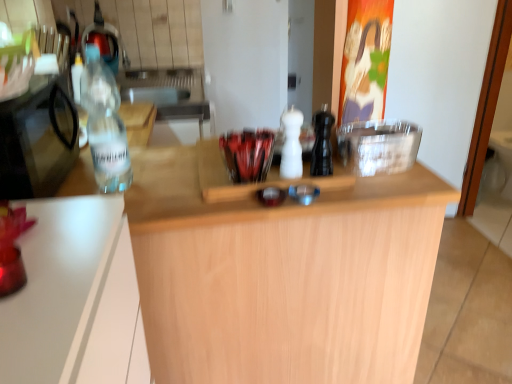
This screenshot has width=512, height=384. I want to click on clear glass bottle at left, the 3th bottle positioned from the right, so click(x=105, y=126).

The height and width of the screenshot is (384, 512). Describe the element at coordinates (105, 126) in the screenshot. I see `clear glass bottle at left, the first bottle in the left-to-right sequence` at that location.

Locate an element on the screen. The image size is (512, 384). black matte pepper grinder at center, arranged as the first bottle when viewed from the right is located at coordinates (322, 143).

Where is `white matte salt shaker at center, placed as the second bottle when sorted from right to left`? white matte salt shaker at center, placed as the second bottle when sorted from right to left is located at coordinates (291, 145).

What do you see at coordinates (37, 141) in the screenshot? I see `transparent plastic bottle at left, the second appliance viewed from the right` at bounding box center [37, 141].

Where is `clear glass bottle at left, the 3th bottle positioned from the right`? clear glass bottle at left, the 3th bottle positioned from the right is located at coordinates (105, 126).

Is white matte salt shaker at center, placed as the second bottle when sorted from right to left, positioned with its back to light wood countertop at center?

No, light wood countertop at center is not at the back of white matte salt shaker at center, placed as the second bottle when sorted from right to left.

How distant is white matte salt shaker at center, placed as the second bottle when sorted from right to left, from light wood countertop at center?

The distance of white matte salt shaker at center, placed as the second bottle when sorted from right to left, from light wood countertop at center is 15.11 inches.

Visually, is white matte salt shaker at center, placed as the second bottle when sorted from right to left, positioned to the left or to the right of light wood countertop at center?

white matte salt shaker at center, placed as the second bottle when sorted from right to left, is positioned on light wood countertop at center's right side.

Between white matte salt shaker at center, which is the 2th bottle in left-to-right order, and light wood countertop at center, which one is positioned in front?

Positioned in front is light wood countertop at center.

Is black matte pepper grinder at center, arranged as the first bottle when viewed from the right, located outside clear glass bottle at left, the 3th bottle positioned from the right?

That's correct, black matte pepper grinder at center, arranged as the first bottle when viewed from the right, is outside of clear glass bottle at left, the 3th bottle positioned from the right.

Is black matte pepper grinder at center, arranged as the first bottle when viewed from the right, beside clear glass bottle at left, the 3th bottle positioned from the right?

black matte pepper grinder at center, arranged as the first bottle when viewed from the right, and clear glass bottle at left, the 3th bottle positioned from the right, are clearly separated.

Which of these two, black matte pepper grinder at center, arranged as the first bottle when viewed from the right, or clear glass bottle at left, the 3th bottle positioned from the right, is wider?

With larger width is clear glass bottle at left, the 3th bottle positioned from the right.

Which is in front, point (321, 120) or point (109, 123)?

The point (109, 123) is in front.

Is clear glass bottle at left, the 3th bottle positioned from the right, inside or outside of transparent plastic bottle at left, the first appliance from the left?

The correct answer is: outside.

Does clear glass bottle at left, the 3th bottle positioned from the right, have a larger size compared to transparent plastic bottle at left, the second appliance viewed from the right?

No, clear glass bottle at left, the 3th bottle positioned from the right, is not bigger than transparent plastic bottle at left, the second appliance viewed from the right.

What's the angular difference between clear glass bottle at left, the 3th bottle positioned from the right, and transparent plastic bottle at left, the first appliance from the left,'s facing directions?

90 degrees.

Looking at this image, is clear glass bottle at left, the 3th bottle positioned from the right, to the left of transparent plastic bottle at left, the first appliance from the left, from the viewer's perspective?

No.

Which of these two, transparent plastic bottle at left, the second appliance viewed from the right, or white matte salt shaker at center, placed as the second bottle when sorted from right to left, is wider?

With larger width is transparent plastic bottle at left, the second appliance viewed from the right.

Identify the location of the 1st appliance below the white matte salt shaker at center, placed as the second bottle when sorted from right to left (from the image's perspective). The image size is (512, 384). (37, 141).

Is transparent plastic bottle at left, the first appliance from the left, next to white matte salt shaker at center, which is the 2th bottle in left-to-right order?

No, transparent plastic bottle at left, the first appliance from the left, is not with white matte salt shaker at center, which is the 2th bottle in left-to-right order.

From the image's perspective, is transparent plastic bottle at left, the second appliance viewed from the right, under white matte salt shaker at center, which is the 2th bottle in left-to-right order?

Correct, transparent plastic bottle at left, the second appliance viewed from the right, appears lower than white matte salt shaker at center, which is the 2th bottle in left-to-right order, in the image.

Consider the image. From the image's perspective, is white matte salt shaker at center, placed as the second bottle when sorted from right to left, located above black matte pepper grinder at center, arranged as the first bottle when viewed from the right?

Indeed, from the image's perspective, white matte salt shaker at center, placed as the second bottle when sorted from right to left, is shown above black matte pepper grinder at center, arranged as the first bottle when viewed from the right.

Where is `the 1st bottle in front of the white matte salt shaker at center, placed as the second bottle when sorted from right to left`? This screenshot has width=512, height=384. the 1st bottle in front of the white matte salt shaker at center, placed as the second bottle when sorted from right to left is located at coordinates (322, 143).

Is point (289, 171) closer to camera compared to point (322, 156)?

Yes, it is in front of point (322, 156).

How different are the orientations of white matte salt shaker at center, placed as the second bottle when sorted from right to left, and black matte pepper grinder at center, marked as the third bottle in a left-to-right arrangement, in degrees?

They differ by 4.97 degrees in their facing directions.

Which object is positioned more to the left, transparent plastic bottle at left, the first appliance from the left, or clear glass bottle at left, the first bottle in the left-to-right sequence?

transparent plastic bottle at left, the first appliance from the left.

In the scene shown: Measure the distance between transparent plastic bottle at left, the second appliance viewed from the right, and clear glass bottle at left, the 3th bottle positioned from the right.

The distance of transparent plastic bottle at left, the second appliance viewed from the right, from clear glass bottle at left, the 3th bottle positioned from the right, is 6.09 inches.

From the picture: From a real-world perspective, which object rests below the other?

From a 3D spatial view, transparent plastic bottle at left, the first appliance from the left, is below.

Is transparent plastic bottle at left, the second appliance viewed from the right, far from clear glass bottle at left, the 3th bottle positioned from the right?

They are positioned close to each other.

Is clear glass bottle at left, the 3th bottle positioned from the right, directly adjacent to white matte salt shaker at center, which is the 2th bottle in left-to-right order?

No, clear glass bottle at left, the 3th bottle positioned from the right, is not in contact with white matte salt shaker at center, which is the 2th bottle in left-to-right order.

What are the coordinates of `bottle that is above the white matte salt shaker at center, placed as the second bottle when sorted from right to left (from the image's perspective)` in the screenshot? It's located at (105, 126).

How different are the orientations of clear glass bottle at left, the first bottle in the left-to-right sequence, and white matte salt shaker at center, placed as the second bottle when sorted from right to left, in degrees?

clear glass bottle at left, the first bottle in the left-to-right sequence, and white matte salt shaker at center, placed as the second bottle when sorted from right to left, are facing 177 degrees away from each other.

From the image's perspective, which one is positioned higher, clear glass bottle at left, the 3th bottle positioned from the right, or white matte salt shaker at center, which is the 2th bottle in left-to-right order?

From the image's view, clear glass bottle at left, the 3th bottle positioned from the right, is above.

At what (x,y) coordinates should I click in order to perform the action: click on bottle that is the 1st object above the light wood countertop at center (from a real-world perspective). Please return your answer as a coordinate pair (x, y). The height and width of the screenshot is (384, 512). Looking at the image, I should click on (291, 145).

You are a GUI agent. You are given a task and a screenshot of the screen. Output one action in this format:
    pyautogui.click(x=<x>, y=<y>)
    Task: Click on the 2nd bottle to the right of the clear glass bottle at left, the 3th bottle positioned from the right, starting your count from the anchor
    This screenshot has height=384, width=512.
    Given the screenshot: What is the action you would take?
    pyautogui.click(x=322, y=143)

Based on their spatial positions, is light wood countertop at center or clear plastic container at center, the first appliance from the right, further from transparent plastic bottle at left, the second appliance viewed from the right?

clear plastic container at center, the first appliance from the right, is further to transparent plastic bottle at left, the second appliance viewed from the right.

When comparing their distances from black matte pepper grinder at center, arranged as the first bottle when viewed from the right, does transparent plastic bottle at left, the first appliance from the left, or light wood countertop at center seem closer?

light wood countertop at center is closer to black matte pepper grinder at center, arranged as the first bottle when viewed from the right.

From the image, which object appears to be nearer to transparent plastic bottle at left, the second appliance viewed from the right, clear plastic container at center, the first appliance from the right, or clear glass bottle at left, the first bottle in the left-to-right sequence?

The object closer to transparent plastic bottle at left, the second appliance viewed from the right, is clear glass bottle at left, the first bottle in the left-to-right sequence.

Looking at the image, which one is located closer to transparent plastic bottle at left, the first appliance from the left, white matte salt shaker at center, which is the 2th bottle in left-to-right order, or light wood countertop at center?

light wood countertop at center is positioned closer to the anchor transparent plastic bottle at left, the first appliance from the left.

Based on their spatial positions, is white matte salt shaker at center, placed as the second bottle when sorted from right to left, or light wood countertop at center further from black matte pepper grinder at center, arranged as the first bottle when viewed from the right?

light wood countertop at center lies further to black matte pepper grinder at center, arranged as the first bottle when viewed from the right, than the other object.

Considering their positions, is clear plastic container at center, the first appliance from the right, positioned further to white matte salt shaker at center, placed as the second bottle when sorted from right to left, than black matte pepper grinder at center, arranged as the first bottle when viewed from the right?

clear plastic container at center, the first appliance from the right.

Considering their positions, is clear glass bottle at left, the 3th bottle positioned from the right, positioned closer to white matte salt shaker at center, placed as the second bottle when sorted from right to left, than clear plastic container at center, which is the 2th appliance from left to right?

clear plastic container at center, which is the 2th appliance from left to right, is closer to white matte salt shaker at center, placed as the second bottle when sorted from right to left.

From the image, which object appears to be nearer to light wood countertop at center, clear glass bottle at left, the first bottle in the left-to-right sequence, or clear plastic container at center, the first appliance from the right?

Among the two, clear plastic container at center, the first appliance from the right, is located nearer to light wood countertop at center.

Locate an element on the screen. Image resolution: width=512 pixels, height=384 pixels. bottle between white matte salt shaker at center, which is the 2th bottle in left-to-right order, and clear plastic container at center, the first appliance from the right, from left to right is located at coordinates (322, 143).

Where is `countertop located between clear glass bottle at left, the 3th bottle positioned from the right, and black matte pepper grinder at center, arranged as the first bottle when viewed from the right, in the left-right direction`? This screenshot has width=512, height=384. countertop located between clear glass bottle at left, the 3th bottle positioned from the right, and black matte pepper grinder at center, arranged as the first bottle when viewed from the right, in the left-right direction is located at coordinates (283, 276).

Where is `countertop between clear glass bottle at left, the first bottle in the left-to-right sequence, and clear plastic container at center, the first appliance from the right, in the horizontal direction`? This screenshot has height=384, width=512. countertop between clear glass bottle at left, the first bottle in the left-to-right sequence, and clear plastic container at center, the first appliance from the right, in the horizontal direction is located at coordinates (283, 276).

Where is `bottle between white matte salt shaker at center, placed as the second bottle when sorted from right to left, and light wood countertop at center, in the vertical direction`? The image size is (512, 384). bottle between white matte salt shaker at center, placed as the second bottle when sorted from right to left, and light wood countertop at center, in the vertical direction is located at coordinates (322, 143).